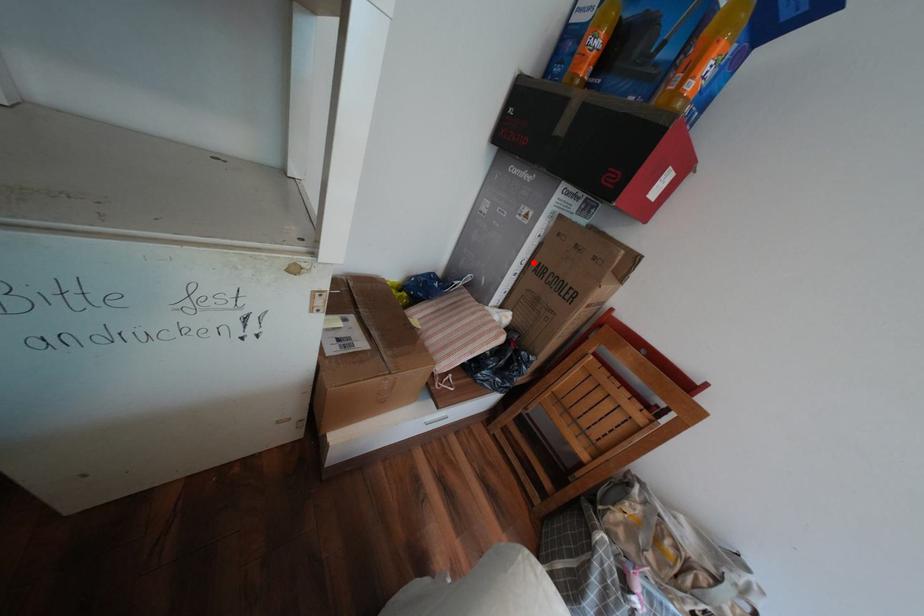
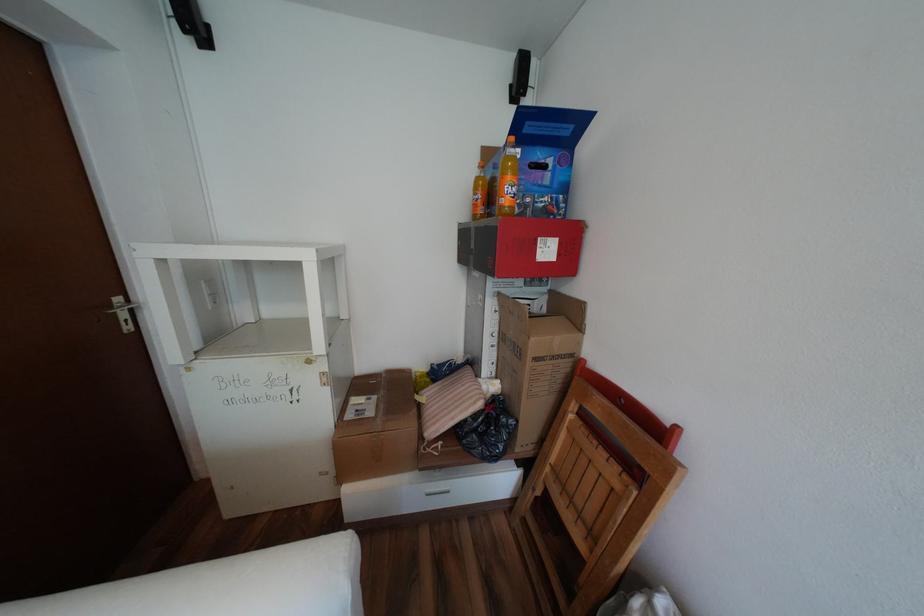
Question: A red point is marked in image1. In image2, is the corresponding 3D point closer to the camera or farther? Reply with the corresponding letter.

Choices:
 (A) The corresponding 3D point is closer.
 (B) The corresponding 3D point is farther.

Answer: (B)